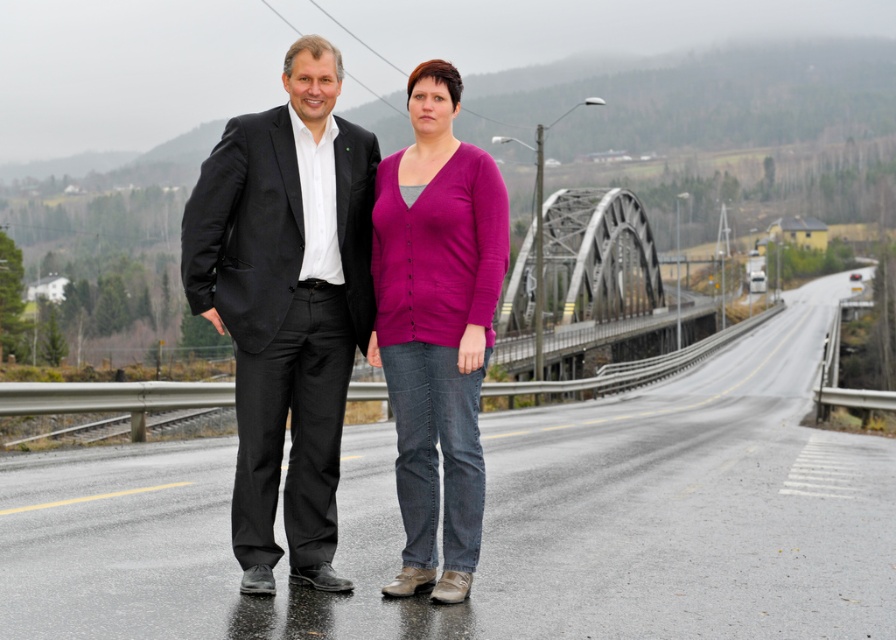
You are taking a photo of the two points in the image. Which point, point [780,392] or point [605,340], will appear larger in your photo?

Point [780,392] is closer to the camera than point [605,340], so it will appear larger in the photo.

You are a photographer planning to take a group photo of the two people wearing the matte black suit at center and the purple cardigan at center. Since you want to ensure both subjects are framed properly, which person should you position closer to the camera to avoid cropping either of them?

The matte black suit at center has a larger width than the purple cardigan at center, so you should position the person wearing the purple cardigan at center closer to the camera to ensure both fit within the frame without cropping.